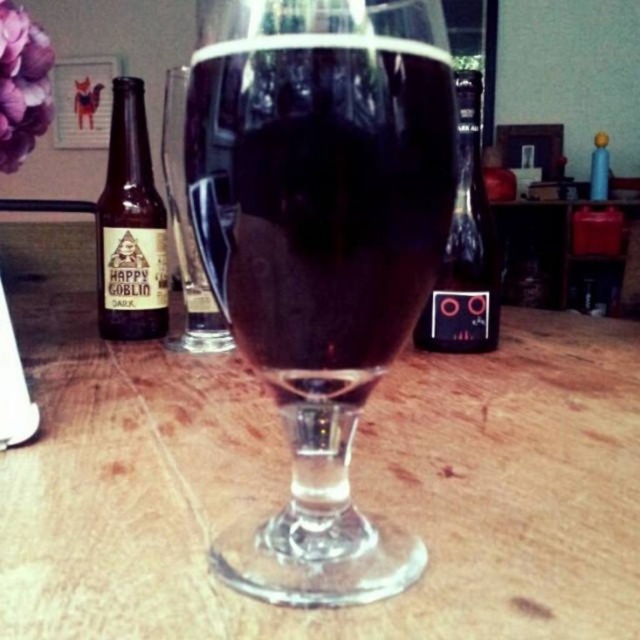
You are arranging bottles on a shelf and need to place the brown glass bottle at left and the black glass bottle at center. According to the image, which bottle should be placed higher on the shelf?

The brown glass bottle at left should be placed higher on the shelf because it is positioned above the black glass bottle at center in the image.

You are a bartender arranging items on a table. You have a transparent glass at center and a black glass bottle at center. If you want to place a coaster between them, where should you place it?

The transparent glass at center is closer to the viewer than the black glass bottle at center, so you should place the coaster between the transparent glass at center and the black glass bottle at center by positioning it closer to the transparent glass at center.